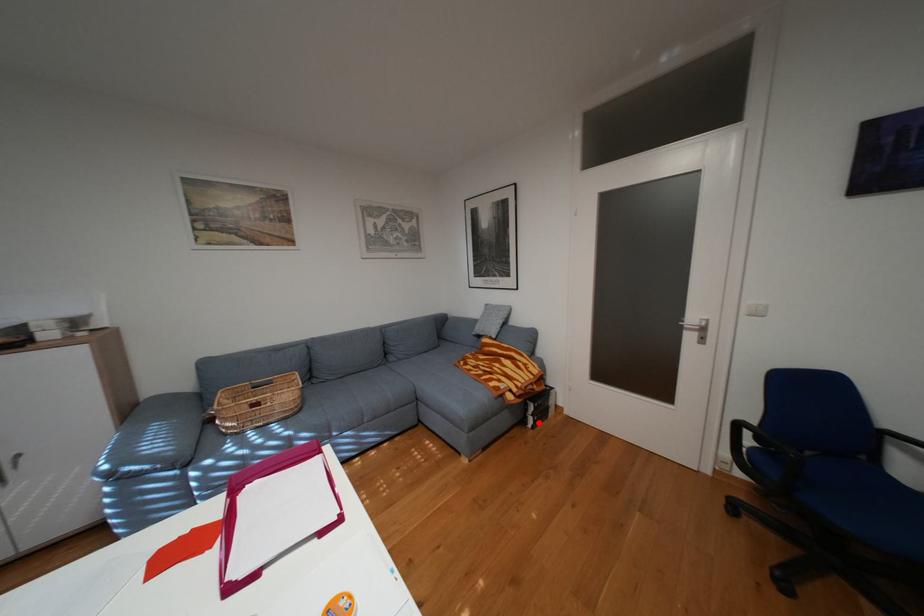
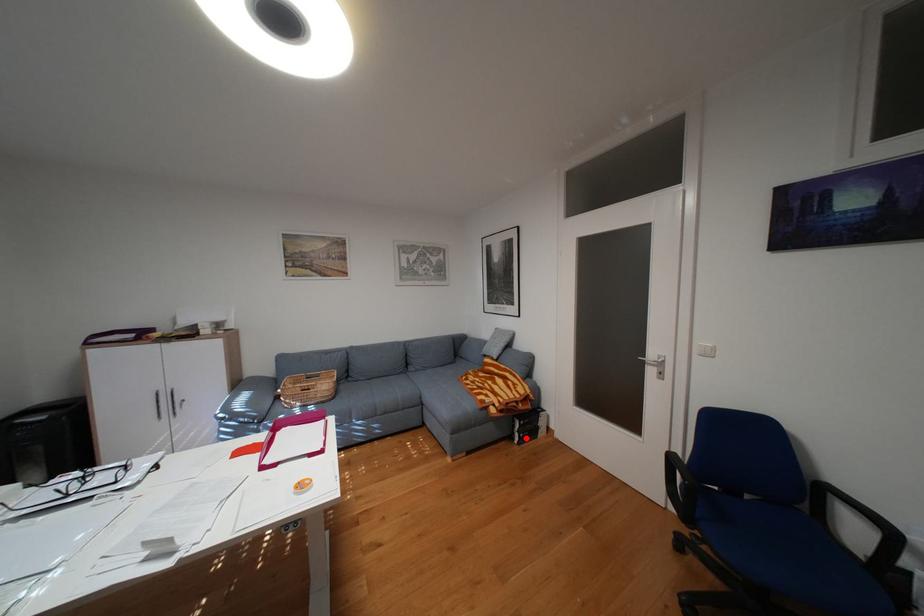
I am providing you with two images of the same scene from different viewpoints. A red point is marked on the first image and another point is marked on the second image. Is the marked point in image1 the same physical position as the marked point in image2?

Yes